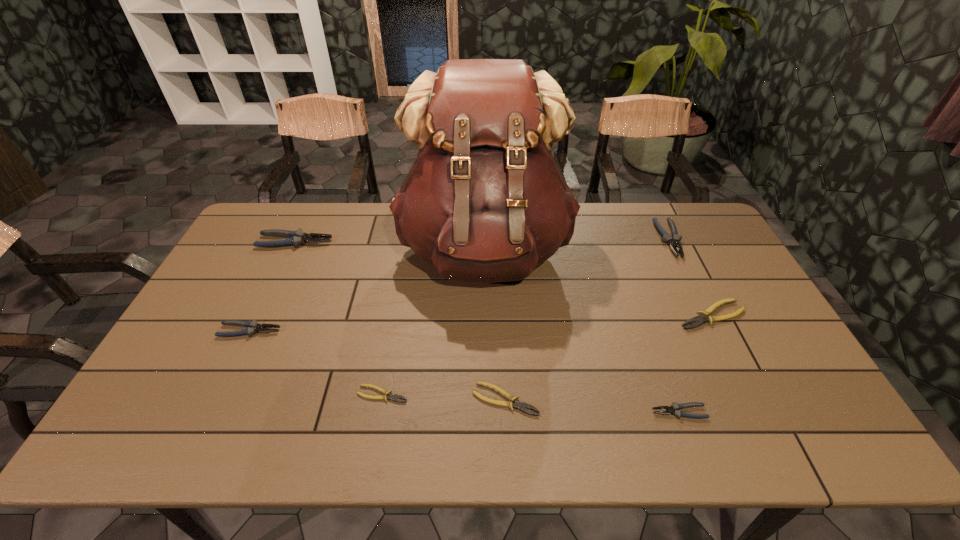
Find the location of a particular element. The height and width of the screenshot is (540, 960). satchel is located at coordinates [x=484, y=202].

This screenshot has width=960, height=540. Find the location of `the tallest pliers`. the tallest pliers is located at coordinates (295, 238).

In order to click on the biggest gray pliers in this screenshot , I will do `click(295, 238)`.

Locate an element on the screen. the second biggest gray pliers is located at coordinates (673, 241).

Locate an element on the screen. The height and width of the screenshot is (540, 960). the sixth shortest pliers is located at coordinates (673, 241).

You are a GUI agent. You are given a task and a screenshot of the screen. Output one action in this format:
    pyautogui.click(x=<x>, y=<y>)
    Task: Click on the second smallest gray pliers
    
    Given the screenshot: What is the action you would take?
    pyautogui.click(x=253, y=327)

Identify the location of the fifth shortest object. (253, 327).

The image size is (960, 540). Identify the location of the farthest yellow pliers. (703, 317).

You are a GUI agent. You are given a task and a screenshot of the screen. Output one action in this format:
    pyautogui.click(x=<x>, y=<y>)
    Task: Click on the rightmost yellow pliers
    The width and height of the screenshot is (960, 540).
    Given the screenshot: What is the action you would take?
    pyautogui.click(x=703, y=317)

The image size is (960, 540). Identify the location of the fifth pliers from left to right. (675, 410).